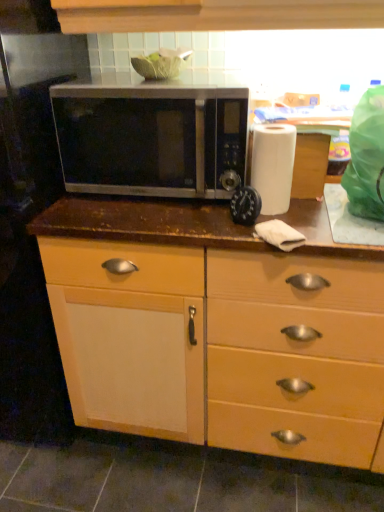
You are a GUI agent. You are given a task and a screenshot of the screen. Output one action in this format:
    pyautogui.click(x=<x>, y=<y>)
    Task: Click on the free space to the left of white matte paper towel at right
    This screenshot has width=384, height=512.
    Given the screenshot: What is the action you would take?
    pyautogui.click(x=196, y=216)